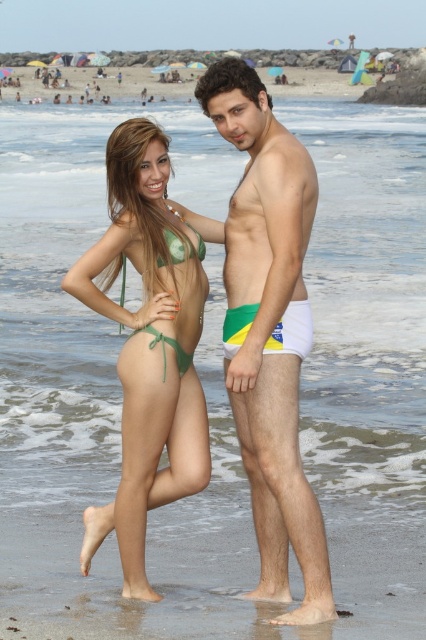
You are a photographer taking a picture of the beach scene. You need to focus on the white matte underwear at center. Where should you aim your camera to capture it accurately?

To capture the white matte underwear at center, aim your camera at the coordinates point (x=268, y=332).

You are designing a swimsuit catalog and need to compare the sizes of the green matte bikini bottom at center and the white fabric shorts at right. Which one has a greater width?

The green matte bikini bottom at center has a greater width than the white fabric shorts at right.